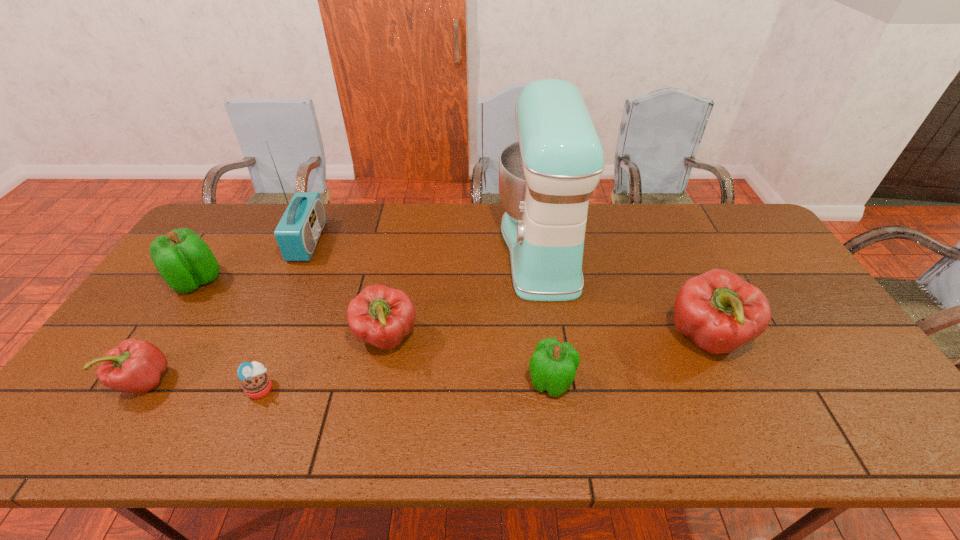
This screenshot has height=540, width=960. What are the coordinates of `vacant area situated 0.290m on the front of the left green bell pepper` in the screenshot? It's located at (128, 387).

The height and width of the screenshot is (540, 960). What are the coordinates of `vacant space situated on the left of the second smallest pink bell pepper` in the screenshot? It's located at (250, 338).

Locate an element on the screen. Image resolution: width=960 pixels, height=540 pixels. vacant space located on the back of the fourth bell pepper from left to right is located at coordinates (545, 339).

Where is `vacant space located on the right of the leftmost pink bell pepper`? The height and width of the screenshot is (540, 960). vacant space located on the right of the leftmost pink bell pepper is located at coordinates [x=312, y=381].

I want to click on vacant space located on the front-facing side of the pink muffin, so click(x=303, y=388).

You are a GUI agent. You are given a task and a screenshot of the screen. Output one action in this format:
    pyautogui.click(x=<x>, y=<y>)
    Task: Click on the mixer at the far edge
    The width and height of the screenshot is (960, 540).
    Given the screenshot: What is the action you would take?
    pyautogui.click(x=546, y=178)

You are a GUI agent. You are given a task and a screenshot of the screen. Output one action in this format:
    pyautogui.click(x=<x>, y=<y>)
    Task: Click on the radio receiver located at the far edge
    Image resolution: width=960 pixels, height=540 pixels.
    Given the screenshot: What is the action you would take?
    pyautogui.click(x=297, y=234)

Where is `free space at the far edge`? This screenshot has width=960, height=540. free space at the far edge is located at coordinates (380, 212).

Identify the location of vacant space at the near edge. The image size is (960, 540). (659, 430).

Where is `vacant area at the left edge of the desktop`? The height and width of the screenshot is (540, 960). vacant area at the left edge of the desktop is located at coordinates (179, 299).